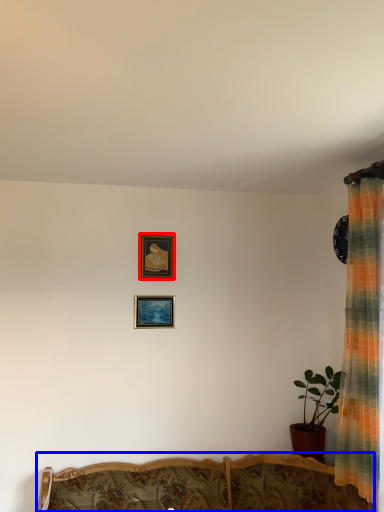
Question: Which object appears closest to the camera in this image, picture frame (highlighted by a red box) or furniture (highlighted by a blue box)?

Choices:
 (A) picture frame
 (B) furniture

Answer: (B)